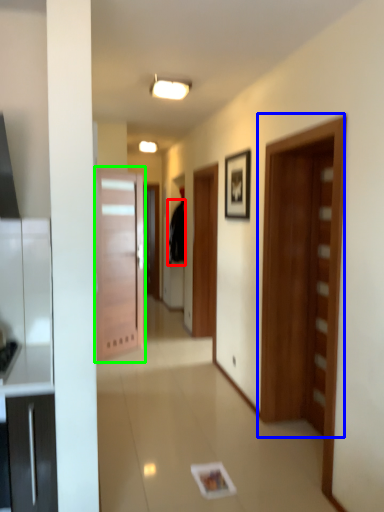
Question: Based on their relative distances, which object is nearer to robe (highlighted by a red box)? Choose from door (highlighted by a blue box) and door (highlighted by a green box).

Choices:
 (A) door
 (B) door

Answer: (B)